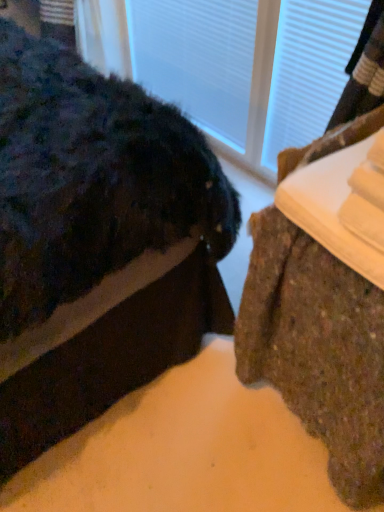
Question: From a real-world perspective, is brown textured rug at lower right, the 1th furniture when ordered from left to right, positioned over brown textured rug at lower right, the second furniture when ordered from left to right, based on gravity?

Choices:
 (A) yes
 (B) no

Answer: (A)

Question: Does brown textured rug at lower right, the 1th furniture when ordered from left to right, appear on the left side of brown textured rug at lower right, the second furniture when ordered from left to right?

Choices:
 (A) yes
 (B) no

Answer: (A)

Question: From a real-world perspective, is brown textured rug at lower right, the 2th furniture positioned from the right, located beneath brown textured rug at lower right, the second furniture when ordered from left to right?

Choices:
 (A) no
 (B) yes

Answer: (A)

Question: Is brown textured rug at lower right, the 2th furniture positioned from the right, wider than brown textured rug at lower right, marked as the 1th furniture in a right-to-left arrangement?

Choices:
 (A) no
 (B) yes

Answer: (B)

Question: Is brown textured rug at lower right, the 2th furniture positioned from the right, far away from brown textured rug at lower right, marked as the 1th furniture in a right-to-left arrangement?

Choices:
 (A) no
 (B) yes

Answer: (A)

Question: Can you confirm if brown textured rug at lower right, the 2th furniture positioned from the right, is thinner than brown textured rug at lower right, marked as the 1th furniture in a right-to-left arrangement?

Choices:
 (A) yes
 (B) no

Answer: (B)

Question: Is the depth of brown textured rug at lower right, the second furniture when ordered from left to right, less than that of transparent glass door at upper center?

Choices:
 (A) no
 (B) yes

Answer: (B)

Question: Does brown textured rug at lower right, the second furniture when ordered from left to right, contain transparent glass door at upper center?

Choices:
 (A) no
 (B) yes

Answer: (A)

Question: Considering the relative sizes of brown textured rug at lower right, marked as the 1th furniture in a right-to-left arrangement, and transparent glass door at upper center in the image provided, is brown textured rug at lower right, marked as the 1th furniture in a right-to-left arrangement, shorter than transparent glass door at upper center?

Choices:
 (A) yes
 (B) no

Answer: (A)

Question: From the image's perspective, is brown textured rug at lower right, marked as the 1th furniture in a right-to-left arrangement, located beneath transparent glass door at upper center?

Choices:
 (A) yes
 (B) no

Answer: (A)

Question: From the image's perspective, is brown textured rug at lower right, the second furniture when ordered from left to right, on top of transparent glass door at upper center?

Choices:
 (A) no
 (B) yes

Answer: (A)

Question: Is brown textured rug at lower right, marked as the 1th furniture in a right-to-left arrangement, taller than transparent glass door at upper center?

Choices:
 (A) no
 (B) yes

Answer: (A)

Question: Can you confirm if transparent glass door at upper center is positioned to the left of brown textured rug at lower right, the 1th furniture when ordered from left to right?

Choices:
 (A) no
 (B) yes

Answer: (A)